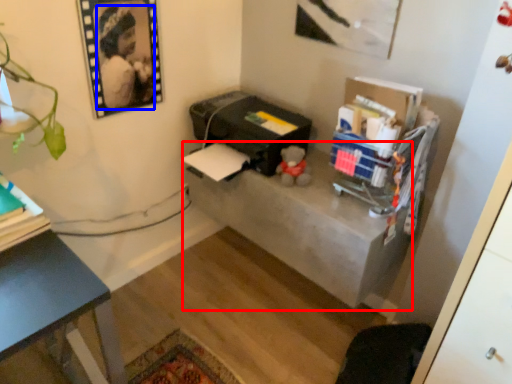
Question: Which object is further to the camera taking this photo, table (highlighted by a red box) or person (highlighted by a blue box)?

Choices:
 (A) table
 (B) person

Answer: (A)